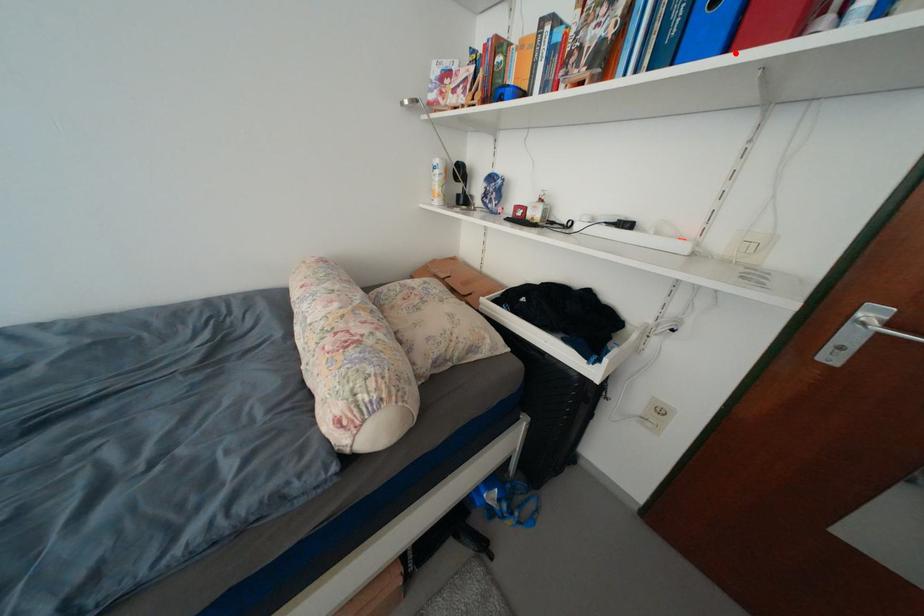
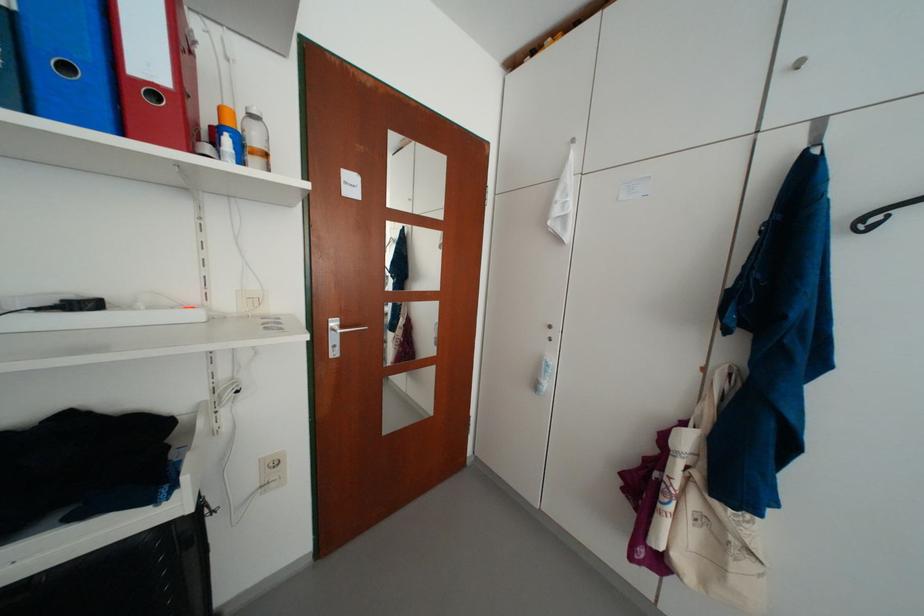
Locate, in the second image, the point that corresponds to the highlighted location in the first image.

(130, 136)